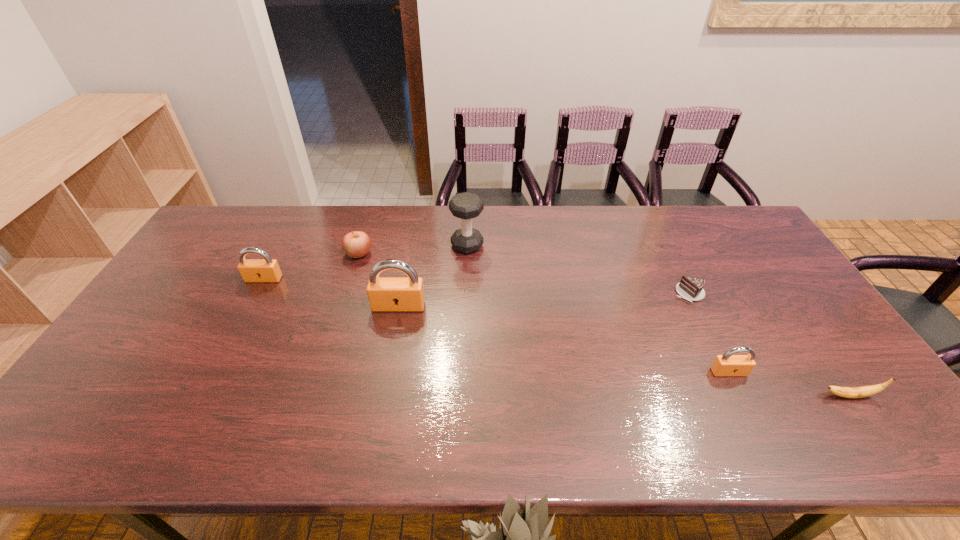
Locate an element on the screen. This screenshot has width=960, height=540. the leftmost padlock is located at coordinates (267, 269).

Identify the location of the fifth shortest object. Image resolution: width=960 pixels, height=540 pixels. (267, 269).

Locate an element on the screen. This screenshot has width=960, height=540. the fifth object from right to left is located at coordinates (386, 294).

Image resolution: width=960 pixels, height=540 pixels. What are the coordinates of `the second nearest padlock` in the screenshot? It's located at (386, 294).

Find the location of `the nearest padlock`. the nearest padlock is located at coordinates (728, 364).

Where is `the shortest padlock`? the shortest padlock is located at coordinates (728, 364).

The image size is (960, 540). I want to click on chocolate cake, so click(690, 288).

Identify the location of apple. (356, 244).

Locate an element on the screen. dumbbell is located at coordinates [x=466, y=206].

In order to click on the second shortest object in this screenshot , I will do tap(848, 392).